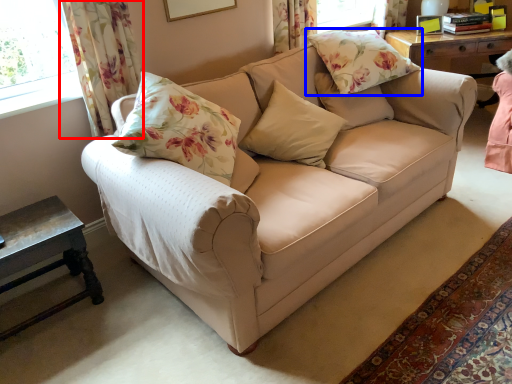
Question: Among these objects, which one is farthest to the camera, curtain (highlighted by a red box) or pillow (highlighted by a blue box)?

Choices:
 (A) curtain
 (B) pillow

Answer: (B)